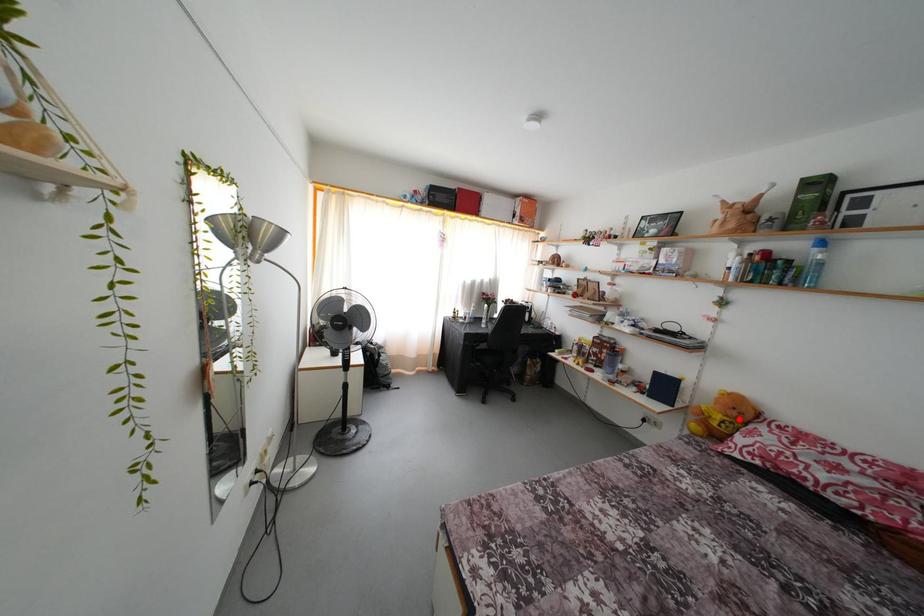
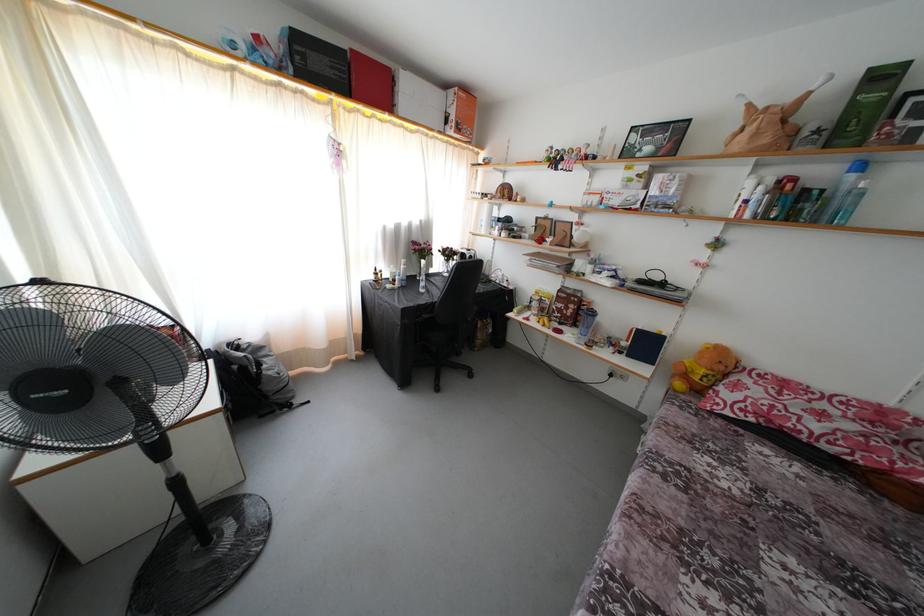
Find the pixel in the second image that matches the highlighted location in the first image.

(726, 373)